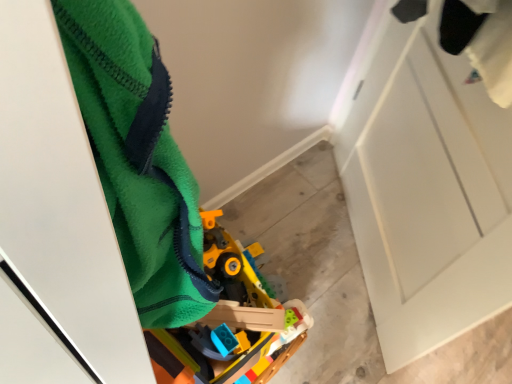
Locate an element on the screen. This screenshot has height=384, width=512. white matte door at upper right is located at coordinates (424, 186).

This screenshot has width=512, height=384. What do you see at coordinates (424, 186) in the screenshot? I see `white matte door at upper right` at bounding box center [424, 186].

Measure the distance between white matte door at upper right and camera.

The distance of white matte door at upper right from camera is 77.96 centimeters.

This screenshot has height=384, width=512. I want to click on white matte door at upper right, so click(424, 186).